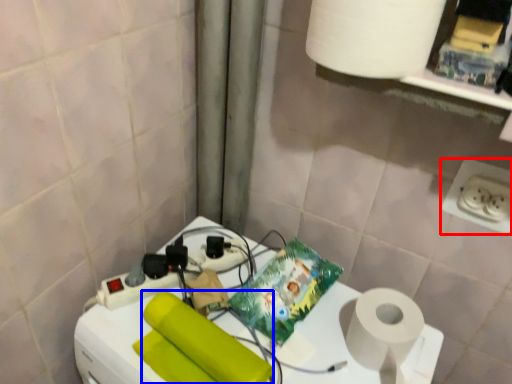
Question: Which of the following is the farthest to the observer, power plugs and sockets (highlighted by a red box) or toilet paper (highlighted by a blue box)?

Choices:
 (A) power plugs and sockets
 (B) toilet paper

Answer: (A)